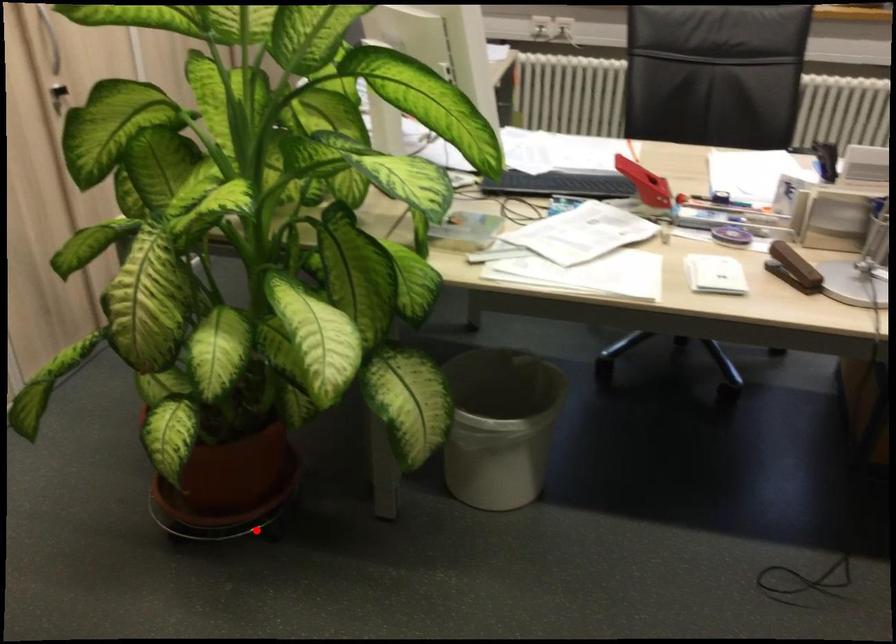
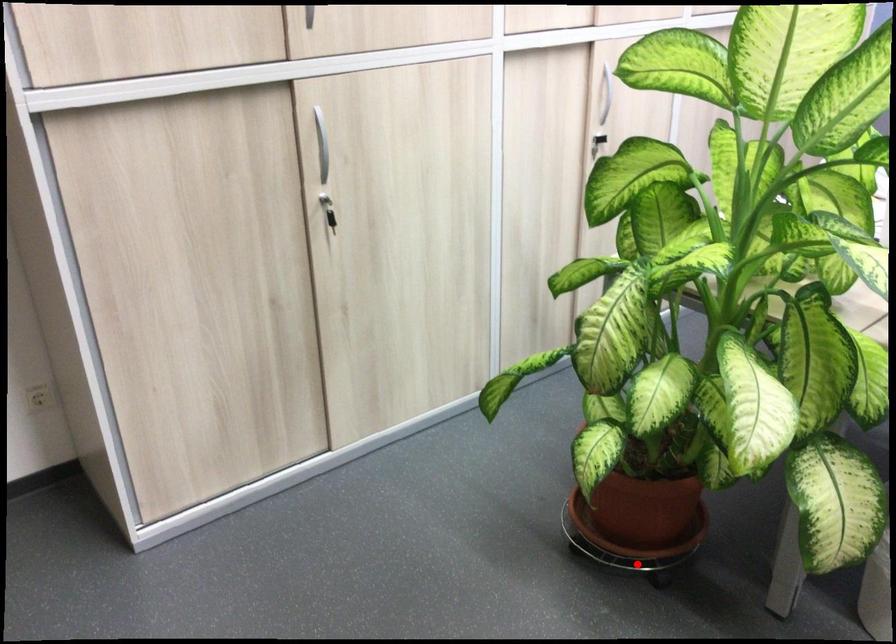
I am providing you with two images of the same scene from different viewpoints. A red point is marked on the first image and another point is marked on the second image. Does the point marked in image1 correspond to the same location as the one in image2?

Yes